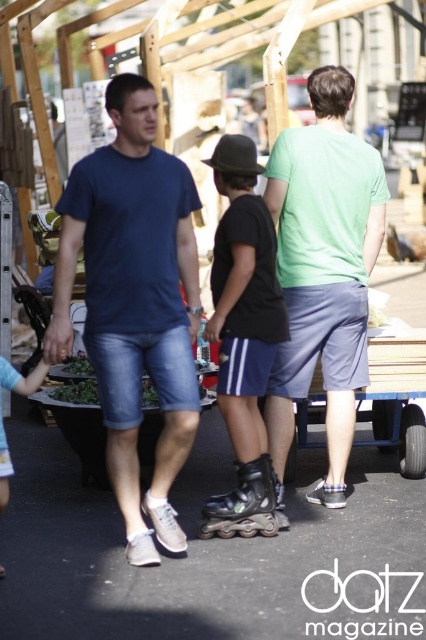
You are a photographer standing at the entrance of the market. You want to take a photo of the blue denim shorts at center. Where should you position your camera to capture it best?

The blue denim shorts at center is located at point (66, 260), so position your camera to aim at that coordinate for the best capture.